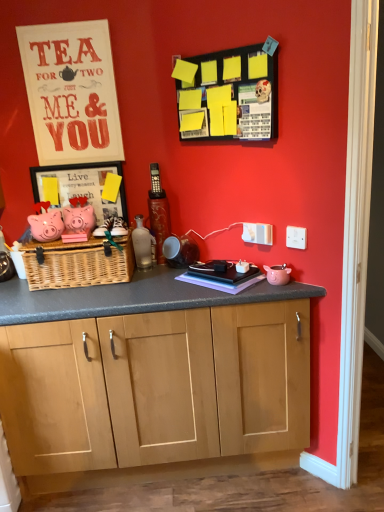
Question: Is matte white signboard at upper left not inside purple matte book at center?

Choices:
 (A) yes
 (B) no

Answer: (A)

Question: From a real-world perspective, is matte white signboard at upper left over purple matte book at center?

Choices:
 (A) no
 (B) yes

Answer: (B)

Question: From the image's perspective, is matte white signboard at upper left over purple matte book at center?

Choices:
 (A) no
 (B) yes

Answer: (B)

Question: Does matte white signboard at upper left have a greater height compared to purple matte book at center?

Choices:
 (A) no
 (B) yes

Answer: (B)

Question: Is matte white signboard at upper left aimed at purple matte book at center?

Choices:
 (A) no
 (B) yes

Answer: (A)

Question: Is purple matte book at center located within matte white signboard at upper left?

Choices:
 (A) yes
 (B) no

Answer: (B)

Question: Is the position of woven natural picnic basket at center less distant than that of purple matte book at center?

Choices:
 (A) yes
 (B) no

Answer: (B)

Question: From a real-world perspective, is woven natural picnic basket at center positioned under purple matte book at center based on gravity?

Choices:
 (A) yes
 (B) no

Answer: (B)

Question: Considering the relative positions of woven natural picnic basket at center and purple matte book at center in the image provided, is woven natural picnic basket at center behind purple matte book at center?

Choices:
 (A) no
 (B) yes

Answer: (B)

Question: From a real-world perspective, is woven natural picnic basket at center on top of purple matte book at center?

Choices:
 (A) yes
 (B) no

Answer: (A)

Question: Can we say woven natural picnic basket at center lies outside purple matte book at center?

Choices:
 (A) no
 (B) yes

Answer: (B)

Question: Is woven natural picnic basket at center to the right of purple matte book at center from the viewer's perspective?

Choices:
 (A) yes
 (B) no

Answer: (B)

Question: Does purple matte book at center appear on the right side of matte white signboard at upper left?

Choices:
 (A) yes
 (B) no

Answer: (A)